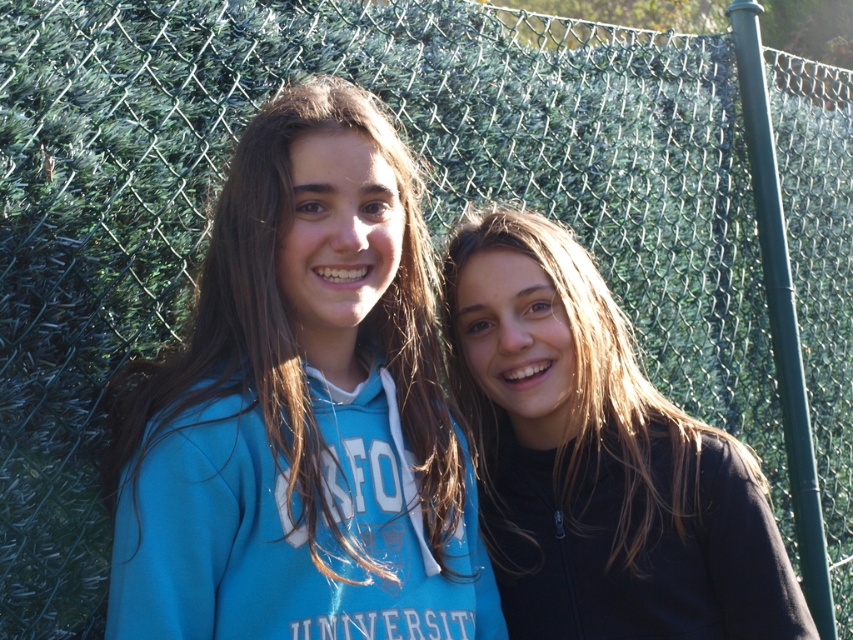
You are standing at the point marked as point (x=254, y=236) in the image. You want to take a photo of the two people in front of you using a camera that has a maximum focus range of 1.5 meters. Will the camera be able to focus on the two people?

The distance between point (x=254, y=236) and the camera is 1.46 meters, which is within the camera maximum focus range of 1.5 meters. Therefore, the camera can focus on the two people.